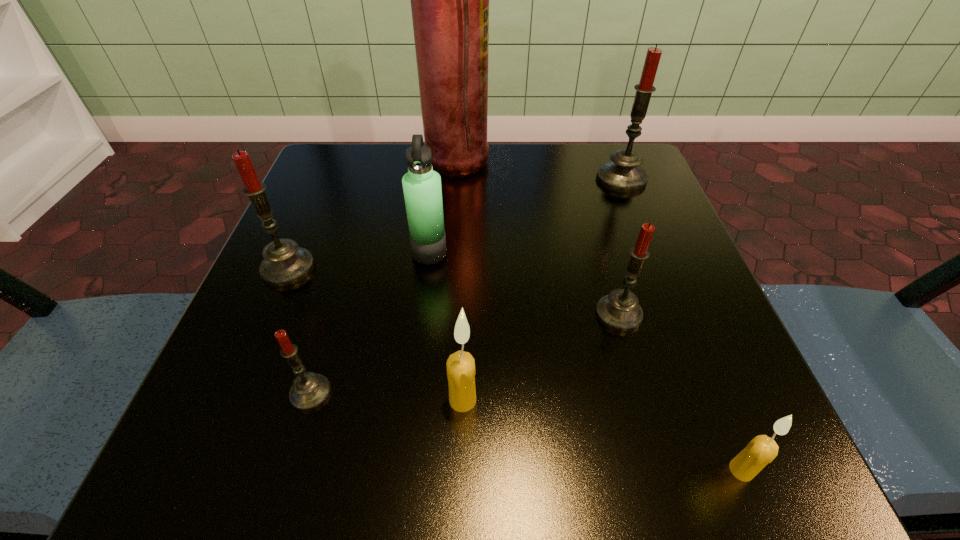
This screenshot has height=540, width=960. In order to click on the tallest object in this screenshot , I will do `click(449, 0)`.

Identify the location of fire extinguisher. The width and height of the screenshot is (960, 540). (449, 0).

Find the location of a particular element. This screenshot has width=960, height=540. the second tallest object is located at coordinates (623, 173).

Locate an element on the screen. The width and height of the screenshot is (960, 540). the biggest red candle is located at coordinates (623, 173).

The height and width of the screenshot is (540, 960). In order to click on the fifth nearest candle in this screenshot , I will do `click(284, 263)`.

Identify the location of the third smallest red candle. The image size is (960, 540). (284, 263).

Where is `thermos bottle`? The width and height of the screenshot is (960, 540). thermos bottle is located at coordinates (422, 190).

Identify the location of the second nearest red candle. Image resolution: width=960 pixels, height=540 pixels. (620, 311).

Identify the location of the second smallest red candle. The image size is (960, 540). (620, 311).

At what (x,y) coordinates should I click in order to perform the action: click on the farther cream candle. Please return your answer as a coordinate pair (x, y). Looking at the image, I should click on (461, 372).